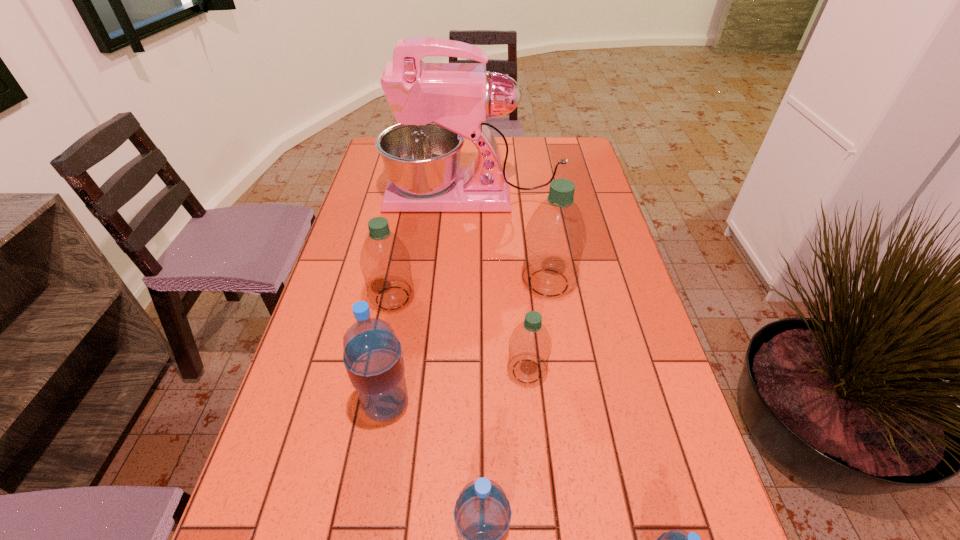
Locate an element on the screen. The width and height of the screenshot is (960, 540). object that is the fifth closest one to the mixer is located at coordinates pyautogui.click(x=482, y=514).

Where is `water bottle that is the nearest to the smallest blue water bottle`? The width and height of the screenshot is (960, 540). water bottle that is the nearest to the smallest blue water bottle is located at coordinates (482, 514).

The image size is (960, 540). In order to click on water bottle that stands as the fourth closest to the tallest object in this screenshot , I will do `click(373, 358)`.

Choose which blue water bottle is the nearest neighbor to the smallest green water bottle. Please provide its 2D coordinates. Your answer should be formatted as a tuple, i.e. [(x, y)], where the tuple contains the x and y coordinates of a point satisfying the conditions above.

[(373, 358)]

The width and height of the screenshot is (960, 540). I want to click on blue water bottle that is the closest to the biggest green water bottle, so click(x=373, y=358).

The height and width of the screenshot is (540, 960). Find the location of `green water bottle that is the third closest to the second smallest blue water bottle`. green water bottle that is the third closest to the second smallest blue water bottle is located at coordinates (555, 237).

Image resolution: width=960 pixels, height=540 pixels. Identify the location of green water bottle that stands as the second closest to the smallest blue water bottle. (555, 237).

In order to click on free region that satisfies the following two spatial constraints: 1. on the back side of the smallest green water bottle; 2. on the face of the tallest object in this screenshot , I will do `click(511, 196)`.

The image size is (960, 540). What are the coordinates of `vacant position in the image that satisfies the following two spatial constraints: 1. on the back side of the second smallest green water bottle; 2. on the left side of the biggest green water bottle` in the screenshot? It's located at (396, 282).

What are the coordinates of `vacant space that satisfies the following two spatial constraints: 1. on the face of the tallest object; 2. on the back side of the biggest green water bottle` in the screenshot? It's located at (472, 282).